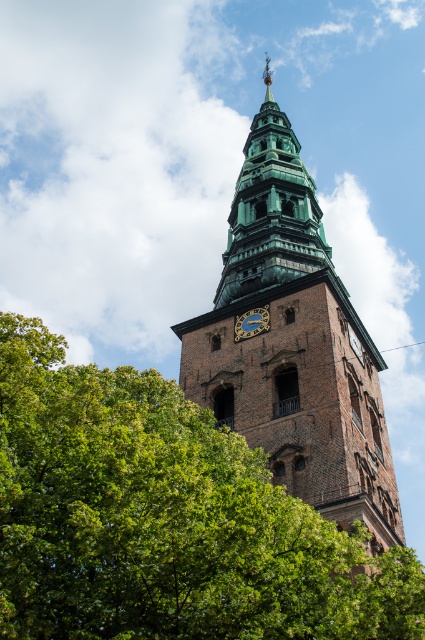
You are standing in a park and see the green leafy tree at lower left and the brown brick church tower at center. Which object is positioned lower in the scene?

The green leafy tree at lower left is positioned lower than the brown brick church tower at center.

You are standing in a park and see the green leafy tree at lower left and the brown brick church tower at center. Which object is closer to you?

The green leafy tree at lower left is closer to you because it is in front of the brown brick church tower at center.

You are a maintenance worker needing to inspect the green metallic clock at center on the brown brick church tower at center. Based on the scene, which object is located higher up and requires climbing to reach?

The brown brick church tower at center is above the green metallic clock at center, so you will need to climb higher to reach the clock since it is positioned lower on the tower.